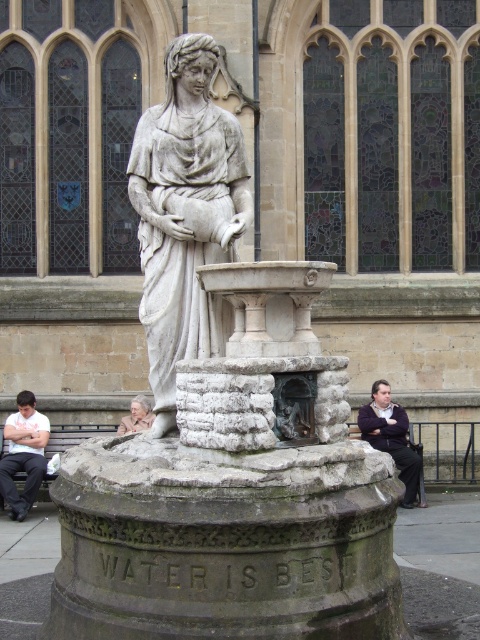
You are standing at the point with coordinates point (142, 397) and want to walk to the point with coordinates point (39, 413). According to the image, which direction should you move to reach your destination?

You should move forward because point (39, 413) is behind point (142, 397), meaning it is in the direction you are facing when standing at point (142, 397).

You are a tourist visiting the historic building and see the white cotton shirt at lower left and the light beige stone statue at center. Which object is closer to you?

The white cotton shirt at lower left is closer to you because it is in front of the light beige stone statue at center.

You are a photographer standing in front of the fountain and notice a white cotton shirt at lower left and a light beige stone statue at center. Which object would you need to zoom in more to capture details of?

The white cotton shirt at lower left is larger in size than the light beige stone statue at center, so you would need to zoom in more on the light beige stone statue at center to capture its details since it is smaller.